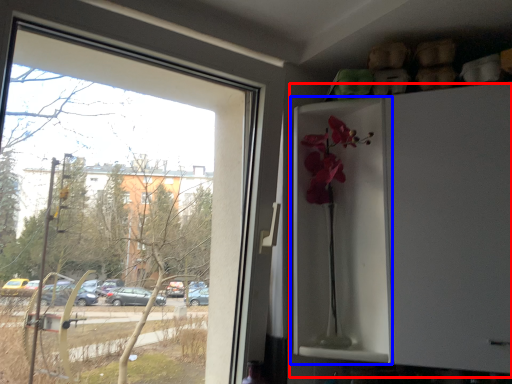
Question: Which of the following is the closest to the observer, fridge (highlighted by a red box) or screen door (highlighted by a blue box)?

Choices:
 (A) fridge
 (B) screen door

Answer: (A)